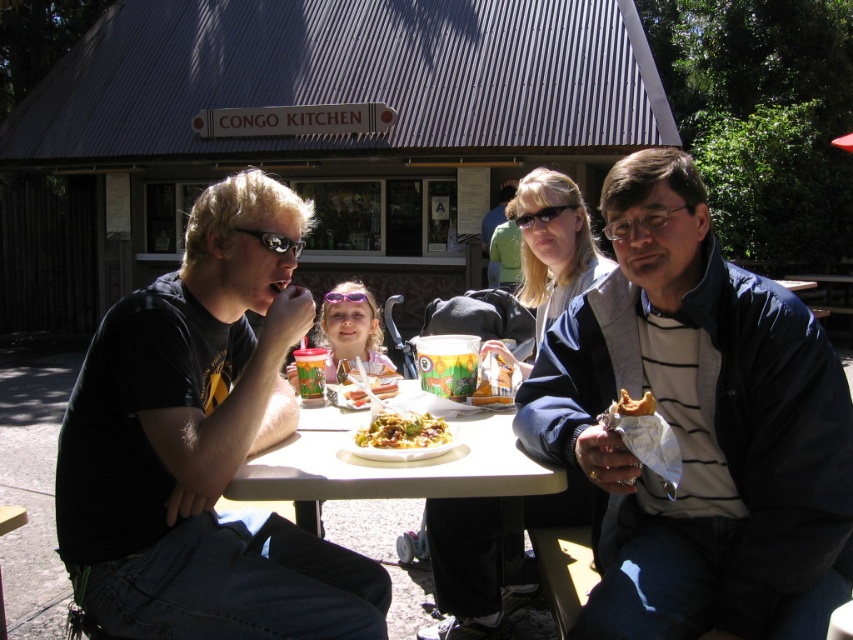
Is matte black jacket at center to the left of dark blue jacket at right from the viewer's perspective?

Incorrect, matte black jacket at center is not on the left side of dark blue jacket at right.

Is matte black jacket at center positioned before dark blue jacket at right?

No.

Find the location of `matte black jacket at center`. matte black jacket at center is located at coordinates (698, 428).

Can you confirm if matte black jacket at center is taller than matte black goggles at upper left?

Indeed, matte black jacket at center has a greater height compared to matte black goggles at upper left.

Is matte black jacket at center smaller than matte black goggles at upper left?

Incorrect, matte black jacket at center is not smaller in size than matte black goggles at upper left.

The height and width of the screenshot is (640, 853). I want to click on matte black jacket at center, so pos(698,428).

At what (x,y) coordinates should I click in order to perform the action: click on matte black jacket at center. Please return your answer as a coordinate pair (x, y). Looking at the image, I should click on (698, 428).

Based on the photo, who is lower down, dark blue jacket at right or matte black goggles at upper left?

Positioned lower is dark blue jacket at right.

Between dark blue jacket at right and matte black goggles at upper left, which one appears on the right side from the viewer's perspective?

Positioned to the right is dark blue jacket at right.

Find the location of a particular element. The height and width of the screenshot is (640, 853). dark blue jacket at right is located at coordinates (698, 428).